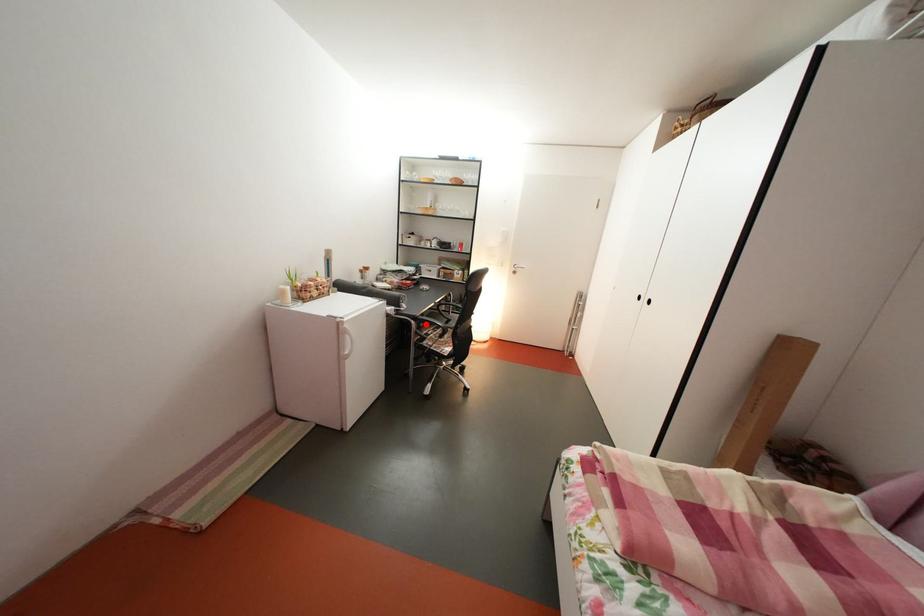
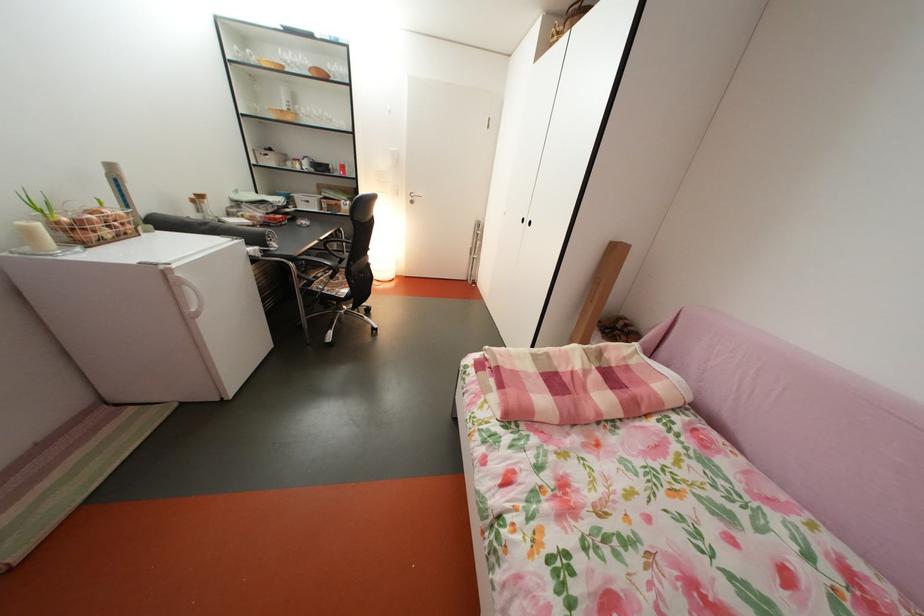
Question: I am providing you with two images of the same scene from different viewpoints. A red point is marked on the first image. Can you still see the location of the red point in image 2?

Choices:
 (A) Yes
 (B) No

Answer: (A)